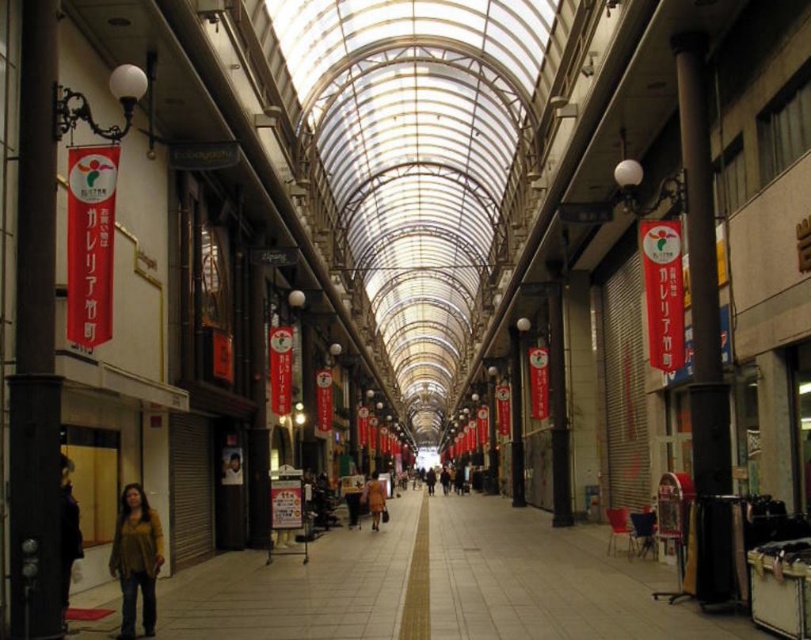
Is yellow knit sweater at lower left thinner than dark brown leather jacket at lower left?

Yes.

Can you confirm if yellow knit sweater at lower left is positioned below dark brown leather jacket at lower left?

Indeed, yellow knit sweater at lower left is positioned under dark brown leather jacket at lower left.

Where is `yellow knit sweater at lower left`? yellow knit sweater at lower left is located at coordinates (136, 560).

Does black metal pole at right lie in front of orange fabric coat at center?

That is True.

Which is in front, point (702, 365) or point (380, 484)?

Point (702, 365) is in front.

Identify the location of black metal pole at right. The width and height of the screenshot is (811, 640). (704, 333).

Between black metal pole at right and yellow knit sweater at lower left, which one has less height?

yellow knit sweater at lower left is shorter.

Can you confirm if black metal pole at right is positioned below yellow knit sweater at lower left?

No.

This screenshot has width=811, height=640. What do you see at coordinates (704, 333) in the screenshot?
I see `black metal pole at right` at bounding box center [704, 333].

At what (x,y) coordinates should I click in order to perform the action: click on black metal pole at right. Please return your answer as a coordinate pair (x, y). This screenshot has width=811, height=640. Looking at the image, I should click on (704, 333).